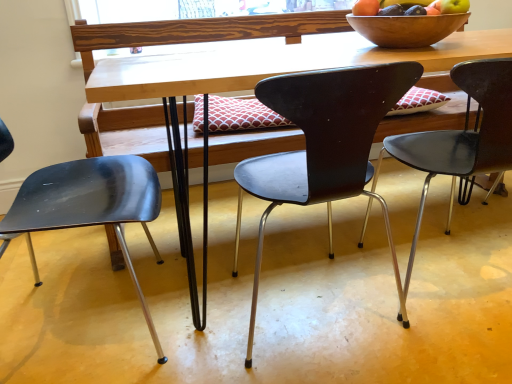
In order to click on vacant space behind metallic black chair at left, arranged as the first chair when viewed from the left in this screenshot , I will do `click(143, 236)`.